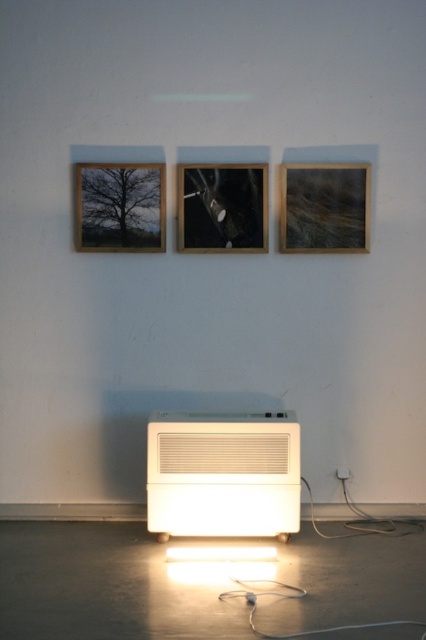
Question: Which object appears closest to the camera in this image?

Choices:
 (A) white plastic plug at lower right
 (B) matte black frame at center

Answer: (B)

Question: Is white plastic air conditioner at lower center closer to camera compared to matte black frame at center?

Choices:
 (A) no
 (B) yes

Answer: (B)

Question: Is white plastic air conditioner at lower center further to camera compared to matte black frame at center?

Choices:
 (A) yes
 (B) no

Answer: (B)

Question: Which object is farther from the camera taking this photo?

Choices:
 (A) white plastic plug at lower right
 (B) wooden frame at center
 (C) wooden frame at upper left

Answer: (A)

Question: Which of the following is the farthest from the observer?

Choices:
 (A) (340, 470)
 (B) (147, 164)

Answer: (A)

Question: Can you confirm if white plastic air conditioner at lower center is thinner than white plastic plug at lower right?

Choices:
 (A) no
 (B) yes

Answer: (A)